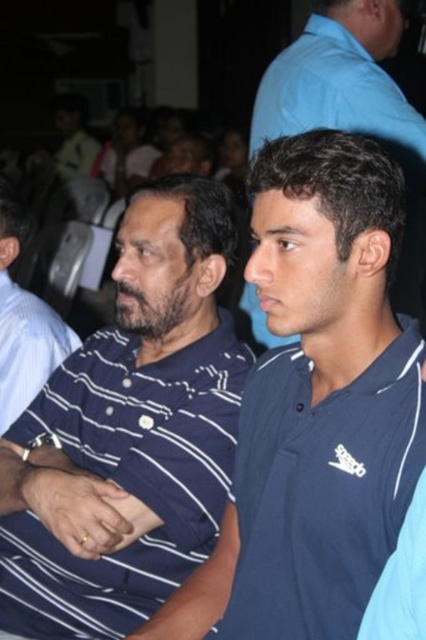
You are organizing a photo shoot and need to arrange two men wearing the dark blue striped polo shirt at center and the blue smooth shirt at center. Based on their heights, which man should stand behind the other to ensure both are visible in the photo?

The dark blue striped polo shirt at center is much taller than the blue smooth shirt at center, so the man wearing the blue smooth shirt at center should stand in front to ensure both are visible in the photo.